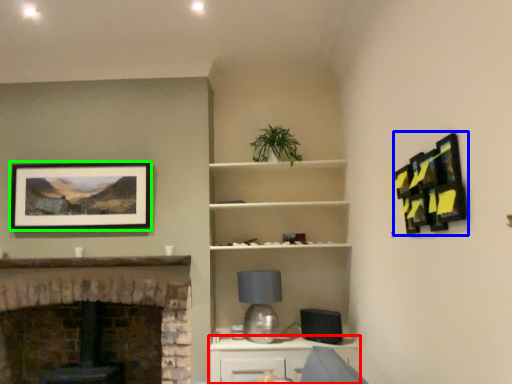
Question: Estimate the real-world distances between objects in this image. Which object is farther from cabinetry (highlighted by a red box), picture frame (highlighted by a blue box) or picture frame (highlighted by a green box)?

Choices:
 (A) picture frame
 (B) picture frame

Answer: (A)